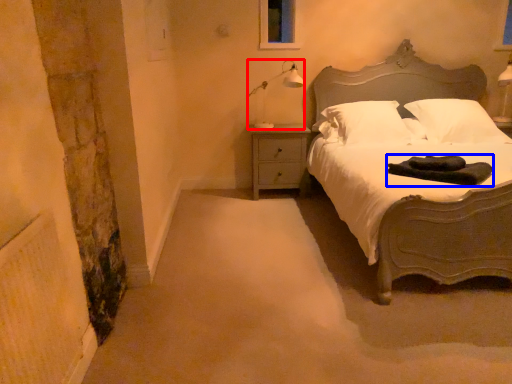
Question: Which point is closer to the camera, lamp (highlighted by a red box) or material (highlighted by a blue box)?

Choices:
 (A) lamp
 (B) material

Answer: (B)